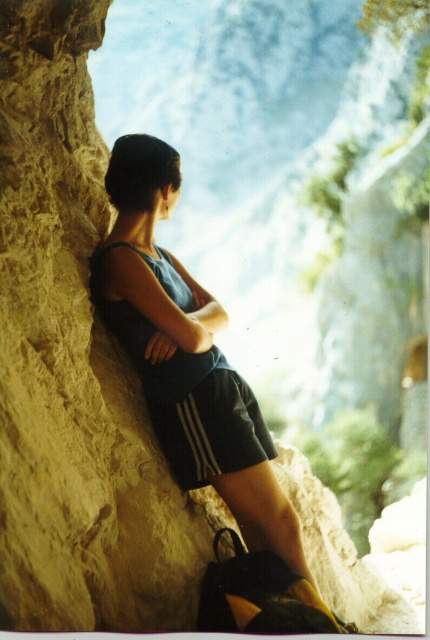
Based on the scene description, which object is wider in the image? The matte blue tank top at center or the black cotton shorts at lower center?

The matte blue tank top at center is wider than the black cotton shorts at lower center according to the description.

Based on the coordinates provided, where exactly is the matte blue tank top at center located in the image?

The matte blue tank top at center is located at the 2D coordinates point (186, 355).

You are a photographer trying to capture the person in the scene. You want to ensure both the matte blue tank top at center and the black cotton shorts at lower center are clearly visible in your photo. Which clothing item should you focus on first to ensure proper exposure, considering their position relative to the light source?

The matte blue tank top at center is positioned on the left side of black cotton shorts at lower center. Since the sunlight is coming from the right side, the black cotton shorts at lower center is more directly exposed to the light. Therefore, you should focus on adjusting exposure for the black cotton shorts at lower center first to avoid overexposure.